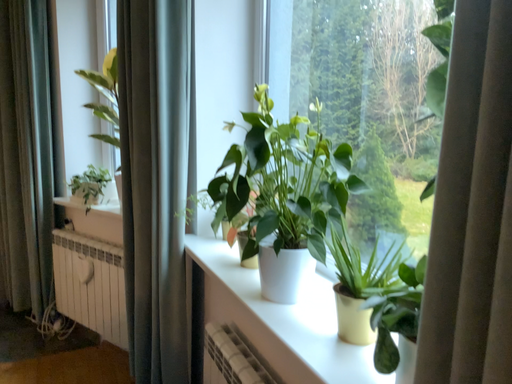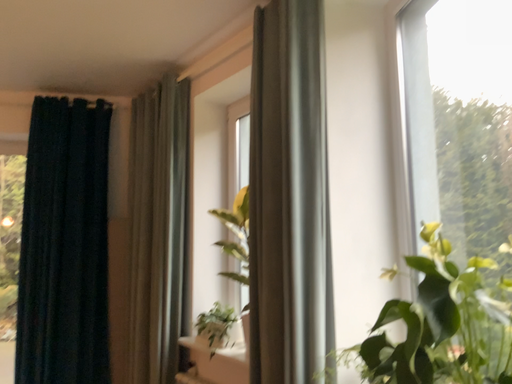
Question: How did the camera likely rotate when shooting the video?

Choices:
 (A) rotated right
 (B) rotated left

Answer: (B)